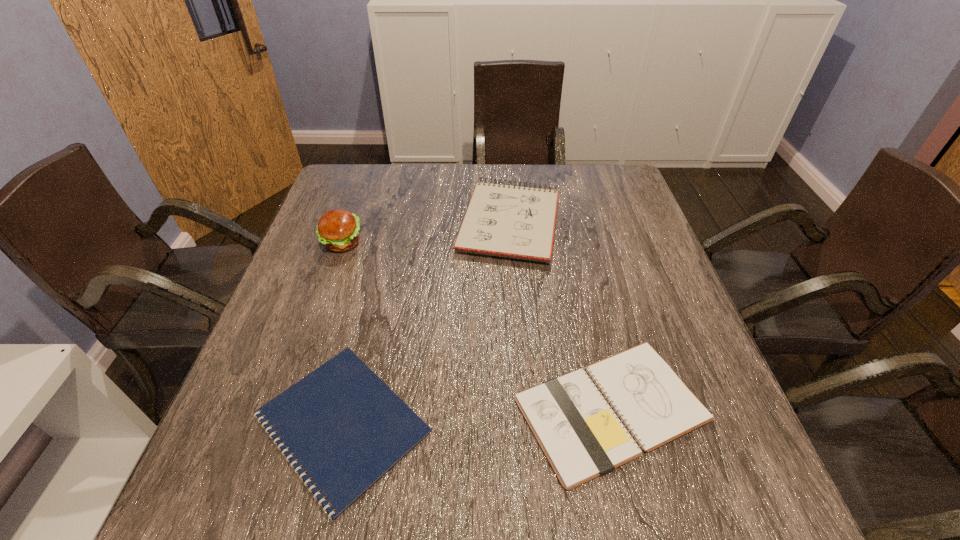
The width and height of the screenshot is (960, 540). In order to click on free spot between the third tallest object and the farthest notepad in this screenshot , I will do `click(560, 316)`.

Locate an element on the screen. Image resolution: width=960 pixels, height=540 pixels. the third closest object to the leftmost notepad is located at coordinates (338, 230).

Identify which object is located as the second nearest to the shortest object. Please provide its 2D coordinates. Your answer should be formatted as a tuple, i.e. [(x, y)], where the tuple contains the x and y coordinates of a point satisfying the conditions above.

[(517, 222)]

Locate an element on the screen. This screenshot has height=540, width=960. notepad object that ranks as the second closest to the leftmost notepad is located at coordinates (517, 222).

This screenshot has width=960, height=540. In order to click on the second closest notepad relative to the third tallest object in this screenshot , I will do `click(517, 222)`.

You are a GUI agent. You are given a task and a screenshot of the screen. Output one action in this format:
    pyautogui.click(x=<x>, y=<y>)
    Task: Click on the vacant space that satisfies the following two spatial constraints: 1. on the back side of the shortest object; 2. on the left side of the farthest notepad
    The height and width of the screenshot is (540, 960).
    Given the screenshot: What is the action you would take?
    pyautogui.click(x=391, y=222)

The width and height of the screenshot is (960, 540). I want to click on free location that satisfies the following two spatial constraints: 1. on the front side of the third tallest object; 2. on the right side of the tallest notepad, so click(x=524, y=409).

You are a GUI agent. You are given a task and a screenshot of the screen. Output one action in this format:
    pyautogui.click(x=<x>, y=<y>)
    Task: Click on the free space that satisfies the following two spatial constraints: 1. on the back side of the leftmost notepad; 2. on the left side of the tallest notepad
    Image resolution: width=960 pixels, height=540 pixels.
    Given the screenshot: What is the action you would take?
    pyautogui.click(x=391, y=222)

Where is `free region that satisfies the following two spatial constraints: 1. on the back side of the hamburger; 2. on the left side of the tallest notepad`? free region that satisfies the following two spatial constraints: 1. on the back side of the hamburger; 2. on the left side of the tallest notepad is located at coordinates (349, 222).

I want to click on free space that satisfies the following two spatial constraints: 1. on the front side of the tallest object; 2. on the right side of the third tallest object, so click(x=283, y=409).